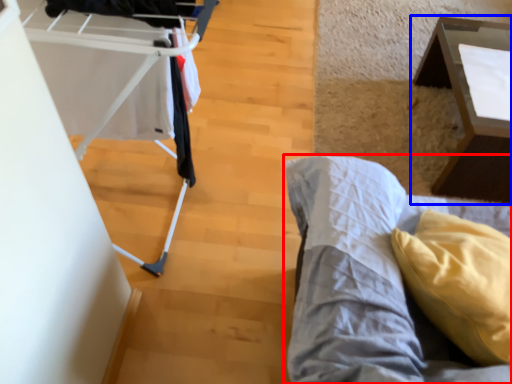
Question: Which object is closer to the camera taking this photo, furniture (highlighted by a red box) or table (highlighted by a blue box)?

Choices:
 (A) furniture
 (B) table

Answer: (A)